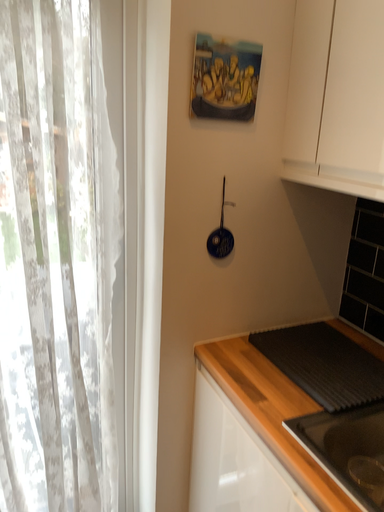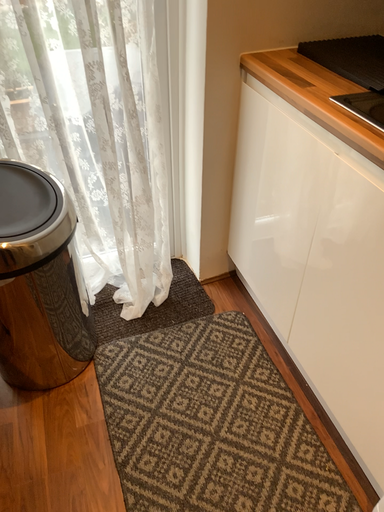
Question: Which way did the camera rotate in the video?

Choices:
 (A) rotated downward
 (B) rotated upward

Answer: (A)